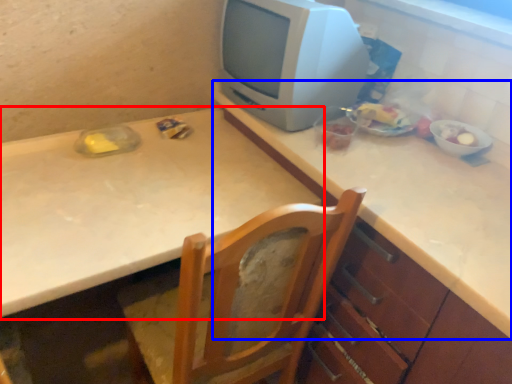
Question: Which of the following is the closest to the observer, table (highlighted by a red box) or counter top (highlighted by a blue box)?

Choices:
 (A) table
 (B) counter top

Answer: (B)